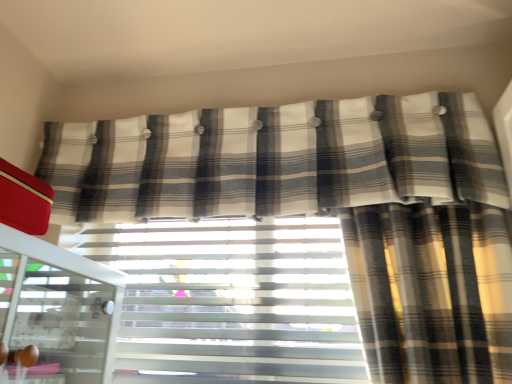
Question: Does white textured blinds at center have a lesser width compared to plaid fabric curtain at upper center?

Choices:
 (A) yes
 (B) no

Answer: (A)

Question: From a real-world perspective, is white textured blinds at center on plaid fabric curtain at upper center?

Choices:
 (A) no
 (B) yes

Answer: (A)

Question: Does white textured blinds at center have a smaller size compared to plaid fabric curtain at upper center?

Choices:
 (A) no
 (B) yes

Answer: (B)

Question: Considering the relative sizes of white textured blinds at center and plaid fabric curtain at upper center in the image provided, is white textured blinds at center shorter than plaid fabric curtain at upper center?

Choices:
 (A) yes
 (B) no

Answer: (B)

Question: Is white textured blinds at center with plaid fabric curtain at upper center?

Choices:
 (A) no
 (B) yes

Answer: (A)

Question: In the image, is white textured blinds at center on the left side or the right side of plaid fabric curtain at upper center?

Choices:
 (A) right
 (B) left

Answer: (B)

Question: Considering the positions of white textured blinds at center and plaid fabric curtain at upper center in the image, is white textured blinds at center wider or thinner than plaid fabric curtain at upper center?

Choices:
 (A) thin
 (B) wide

Answer: (A)

Question: Is white textured blinds at center inside the boundaries of plaid fabric curtain at upper center, or outside?

Choices:
 (A) inside
 (B) outside

Answer: (B)

Question: Is white textured blinds at center taller or shorter than plaid fabric curtain at upper center?

Choices:
 (A) short
 (B) tall

Answer: (B)

Question: Choose the correct answer: Is white textured blinds at center inside white glossy screen door at left or outside it?

Choices:
 (A) outside
 (B) inside

Answer: (A)

Question: Based on their sizes in the image, would you say white textured blinds at center is bigger or smaller than white glossy screen door at left?

Choices:
 (A) small
 (B) big

Answer: (A)

Question: From the image's perspective, is white textured blinds at center above or below white glossy screen door at left?

Choices:
 (A) above
 (B) below

Answer: (B)

Question: In the image, is white textured blinds at center on the left side or the right side of white glossy screen door at left?

Choices:
 (A) right
 (B) left

Answer: (A)

Question: Looking at their shapes, would you say white glossy screen door at left is wider or thinner than plaid fabric curtain at upper center?

Choices:
 (A) thin
 (B) wide

Answer: (B)

Question: From the image's perspective, relative to plaid fabric curtain at upper center, is white glossy screen door at left above or below?

Choices:
 (A) above
 (B) below

Answer: (B)